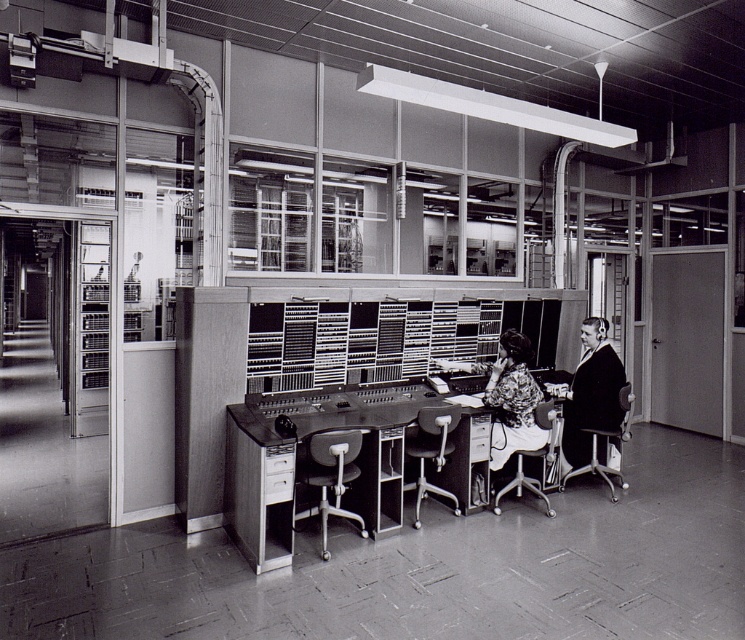
You are standing at the entrance of the vintage office and need to locate the metallic desk at center. According to the coordinates provided, where exactly is the metallic desk positioned in the room?

The metallic desk at center is located at point (329, 461), which means it is positioned towards the right side and slightly above the center of the room based on the coordinate system provided.